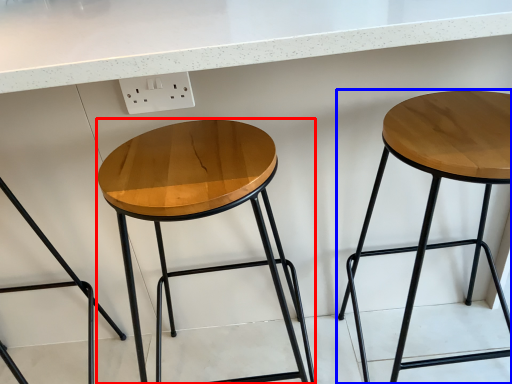
Question: Which point is closer to the camera, stool (highlighted by a red box) or stool (highlighted by a blue box)?

Choices:
 (A) stool
 (B) stool

Answer: (B)